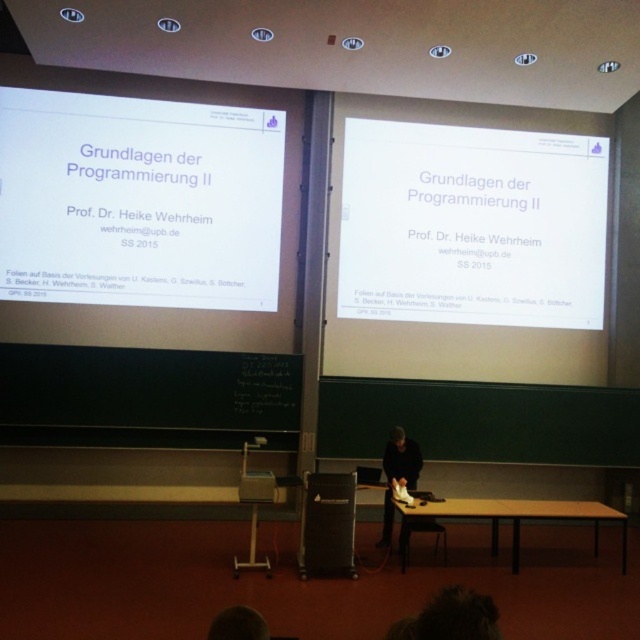
Between white matte projector screen at upper center and dark gray fabric jacket at center, which one is positioned higher?

Positioned higher is white matte projector screen at upper center.

Describe the element at coordinates (472, 225) in the screenshot. The width and height of the screenshot is (640, 640). I see `white matte projector screen at upper center` at that location.

Is point (449, 316) less distant than point (400, 451)?

No.

Locate an element on the screen. This screenshot has height=640, width=640. white matte projector screen at upper center is located at coordinates click(x=472, y=225).

Image resolution: width=640 pixels, height=640 pixels. Find the location of `white matte projector screen at upper left`. white matte projector screen at upper left is located at coordinates (138, 202).

Which is more to the left, white matte projector screen at upper left or white matte projector screen at upper center?

white matte projector screen at upper left

Who is lower down, white matte projector screen at upper left or white matte projector screen at upper center?

white matte projector screen at upper center is lower down.

This screenshot has width=640, height=640. Describe the element at coordinates (138, 202) in the screenshot. I see `white matte projector screen at upper left` at that location.

Identify the location of white matte projector screen at upper left. This screenshot has height=640, width=640. (138, 202).